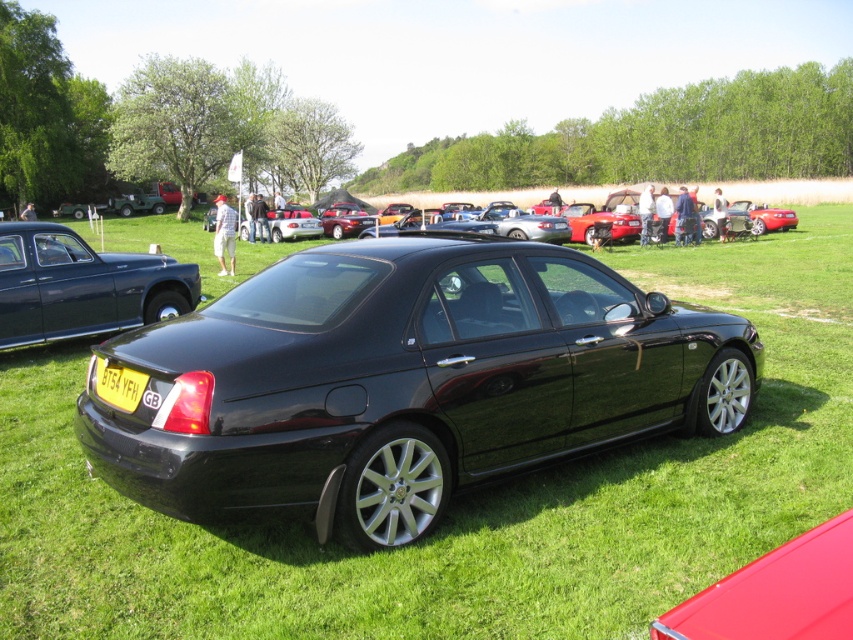
Is shiny black sedan at center closer to the viewer compared to yellow matte license plate at center?

No, shiny black sedan at center is further to the viewer.

Between shiny black sedan at center and yellow matte license plate at center, which one has more height?

Standing taller between the two is shiny black sedan at center.

Between point (91, 300) and point (129, 371), which one is positioned in front?

Point (129, 371)

The height and width of the screenshot is (640, 853). Identify the location of shiny black sedan at center. (82, 285).

Does point (521, 346) lie behind point (109, 376)?

Yes.

The width and height of the screenshot is (853, 640). What do you see at coordinates (404, 381) in the screenshot?
I see `glossy black sedan at center` at bounding box center [404, 381].

What do you see at coordinates (404, 381) in the screenshot? This screenshot has width=853, height=640. I see `glossy black sedan at center` at bounding box center [404, 381].

The width and height of the screenshot is (853, 640). Find the location of `glossy black sedan at center`. glossy black sedan at center is located at coordinates (404, 381).

Who is higher up, shiny black sedan at center or glossy red car at center?

Positioned higher is shiny black sedan at center.

Is shiny black sedan at center to the right of glossy red car at center from the viewer's perspective?

In fact, shiny black sedan at center is to the left of glossy red car at center.

Does point (68, 308) come farther from viewer compared to point (720, 602)?

Yes, point (68, 308) is farther from viewer.

Locate an element on the screen. This screenshot has height=640, width=853. shiny black sedan at center is located at coordinates (82, 285).